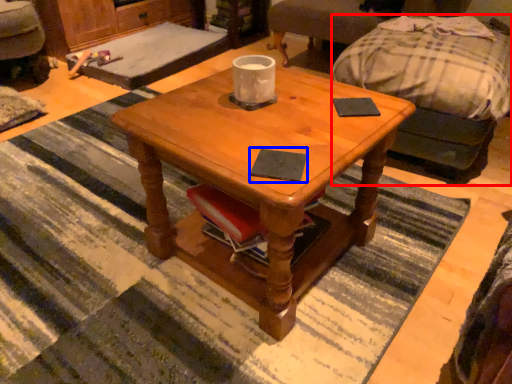
Question: Which object is closer to the camera taking this photo, studio couch (highlighted by a red box) or pad (highlighted by a blue box)?

Choices:
 (A) studio couch
 (B) pad

Answer: (B)